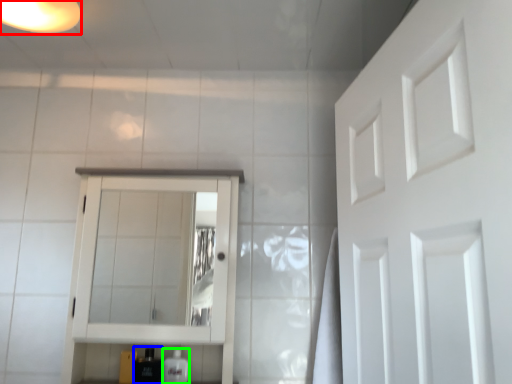
Question: Which object is the farthest from light fixture (highlighted by a red box)? Choose among these: toiletry (highlighted by a blue box) or toiletry (highlighted by a green box).

Choices:
 (A) toiletry
 (B) toiletry

Answer: (B)